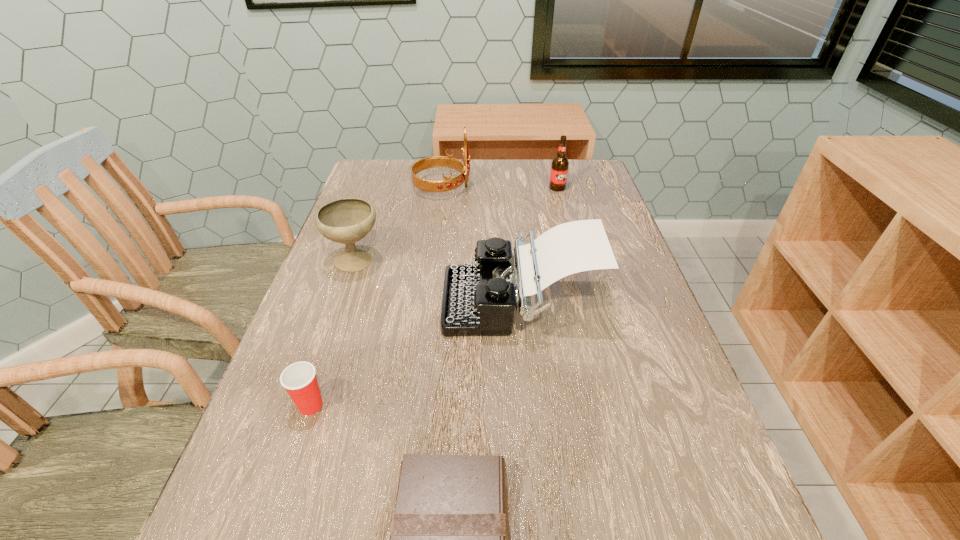
Identify the location of tiara. (448, 184).

Find the location of a particular element. typewriter is located at coordinates (478, 300).

Find the location of a particular element. The image size is (960, 540). root beer is located at coordinates (x=559, y=169).

At what (x,y) coordinates should I click in order to perform the action: click on chalice. Please return your answer as a coordinate pair (x, y). The image size is (960, 540). Looking at the image, I should click on (348, 220).

Find the location of `the fifth farthest object`. the fifth farthest object is located at coordinates (299, 379).

Locate an element on the screen. This screenshot has height=540, width=960. Dixie cup is located at coordinates (299, 379).

This screenshot has height=540, width=960. I want to click on blank area located 0.310m on the front-facing side of the tiara, so click(x=571, y=187).

The height and width of the screenshot is (540, 960). In order to click on free location located on the keys of the typewriter in this screenshot , I will do `click(332, 301)`.

Identify the location of free point located on the keys of the typewriter. (417, 301).

Identify the location of vacant point located on the keys of the typewriter. Image resolution: width=960 pixels, height=540 pixels. (381, 301).